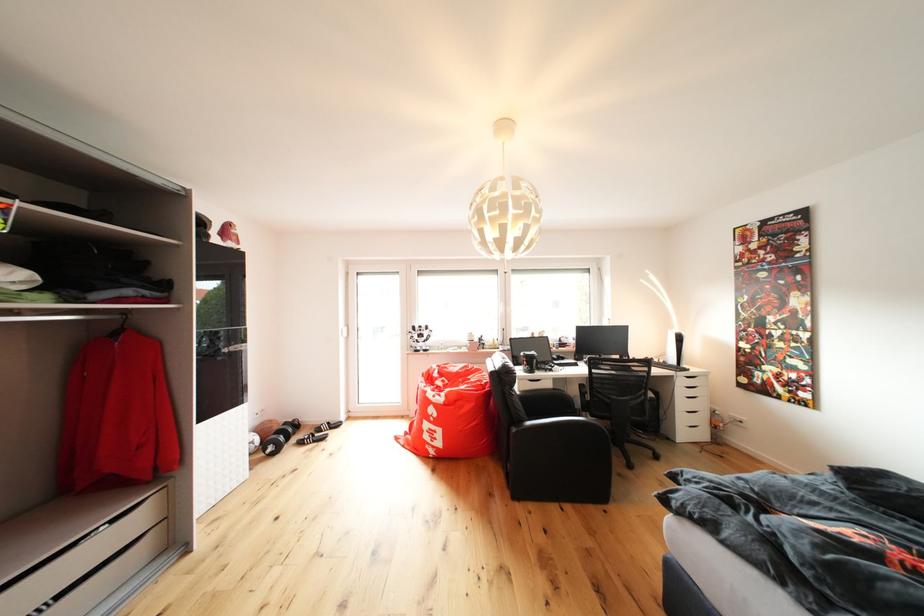
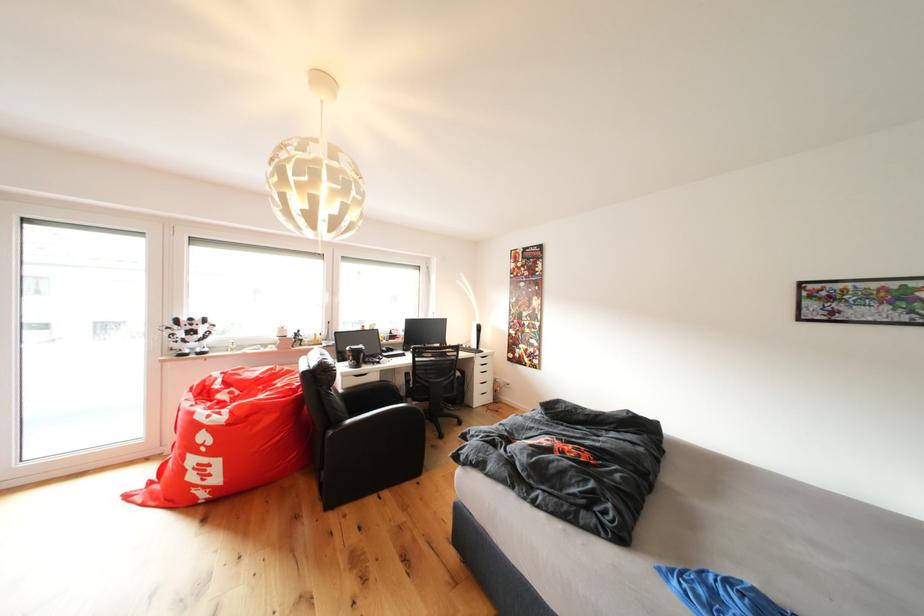
Question: The images are taken continuously from a first-person perspective. In which direction is your viewpoint rotating?

Choices:
 (A) Left
 (B) Right
 (C) Up
 (D) Down

Answer: (B)